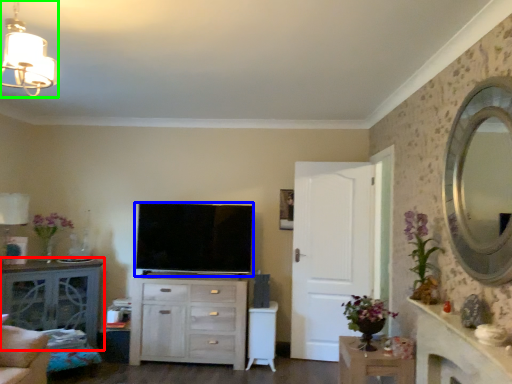
Question: Which object is the farthest from table (highlighted by a red box)? Choose among these: television (highlighted by a blue box) or lamp (highlighted by a green box).

Choices:
 (A) television
 (B) lamp

Answer: (B)